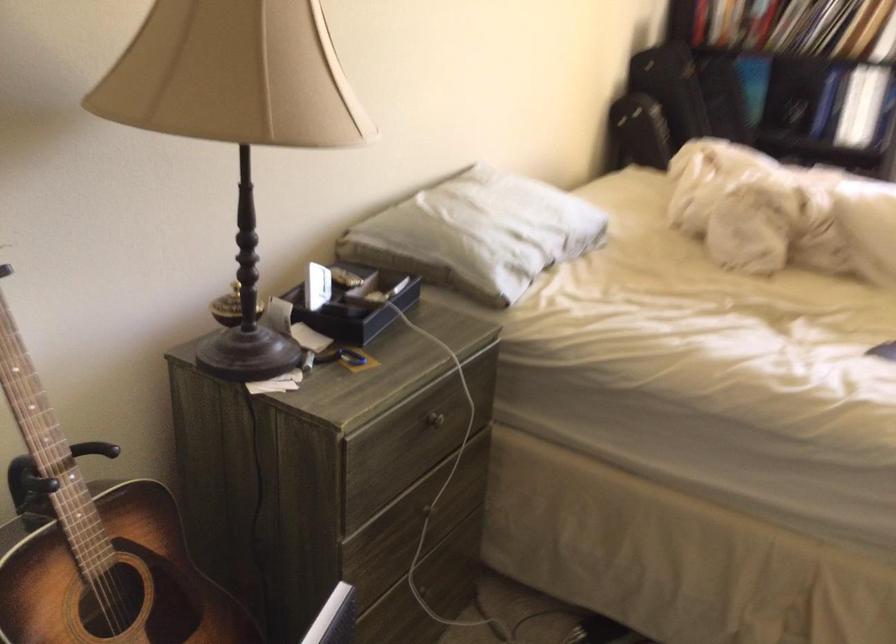
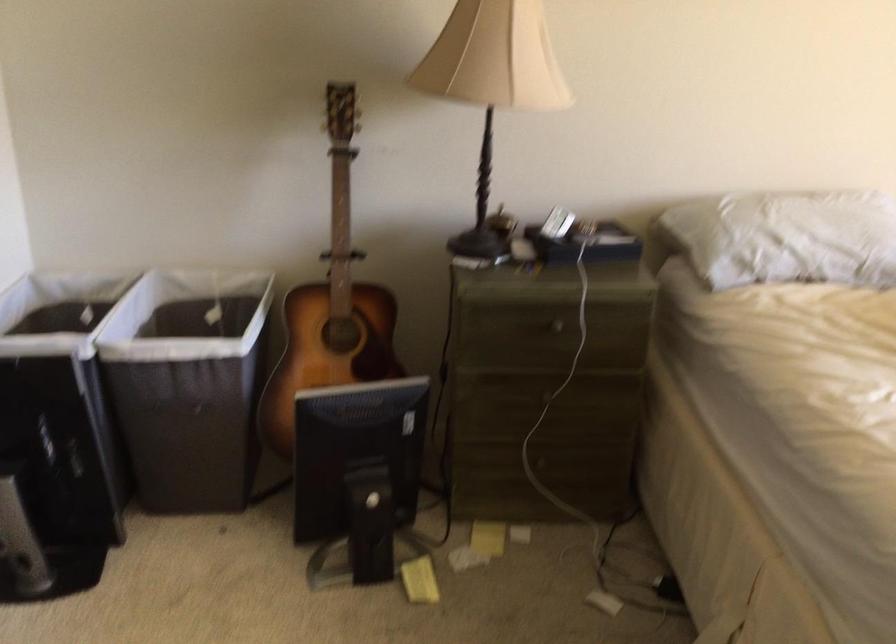
In the second image, find the point that corresponds to point (416, 428) in the first image.

(545, 328)